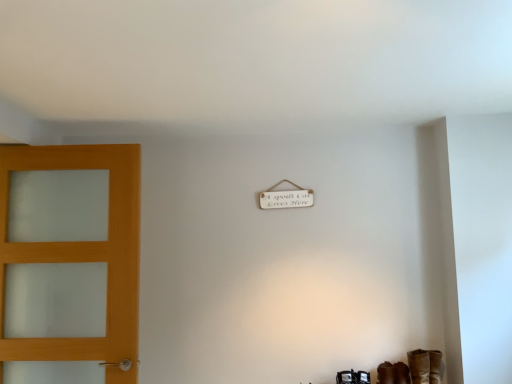
Question: Relative to brown leather shoe at lower right, is matte wood door at left in front or behind?

Choices:
 (A) front
 (B) behind

Answer: (A)

Question: In terms of width, does matte wood door at left look wider or thinner when compared to brown leather shoe at lower right?

Choices:
 (A) thin
 (B) wide

Answer: (A)

Question: Which of these objects is positioned closest to the matte wood door at left?

Choices:
 (A) brown leather boot at lower right
 (B) brown leather shoe at lower right

Answer: (B)

Question: Which is farther from the brown leather boot at lower right?

Choices:
 (A) matte wood door at left
 (B) brown leather shoe at lower right

Answer: (A)